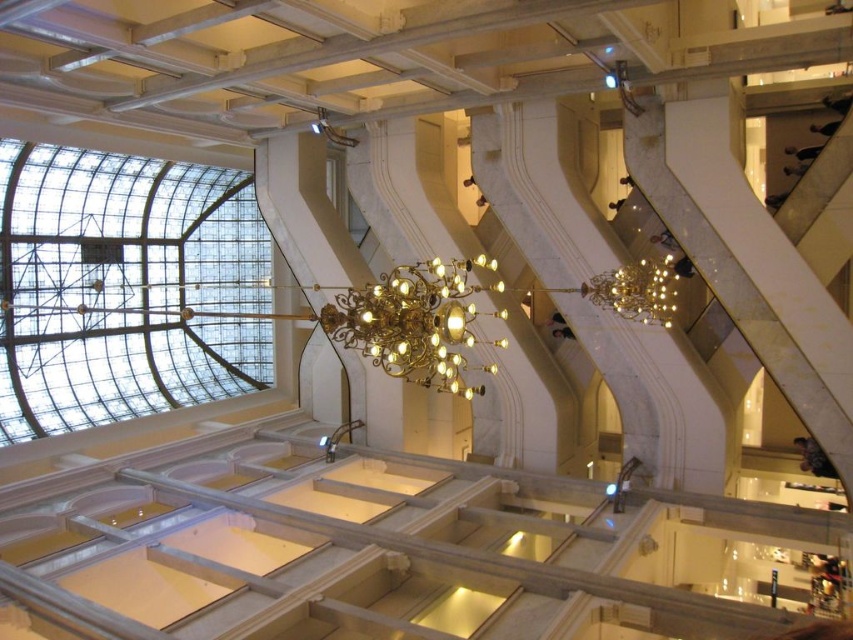
Question: Can you confirm if transparent glass dome at upper center is thinner than gold metallic chandelier at center?

Choices:
 (A) yes
 (B) no

Answer: (B)

Question: Which point appears farthest from the camera in this image?

Choices:
 (A) (387, 349)
 (B) (39, 339)
 (C) (599, 276)

Answer: (B)

Question: Estimate the real-world distances between objects in this image. Which object is farther from the gold metallic chandelier at center?

Choices:
 (A) transparent glass dome at upper center
 (B) gold metallic chandelier at upper center

Answer: (A)

Question: Which object is farther from the camera taking this photo?

Choices:
 (A) transparent glass dome at upper center
 (B) gold metallic chandelier at center
 (C) gold metallic chandelier at upper center

Answer: (C)

Question: Does gold metallic chandelier at center appear on the left side of gold metallic chandelier at upper center?

Choices:
 (A) no
 (B) yes

Answer: (B)

Question: Can you confirm if gold metallic chandelier at center is positioned to the left of gold metallic chandelier at upper center?

Choices:
 (A) yes
 (B) no

Answer: (A)